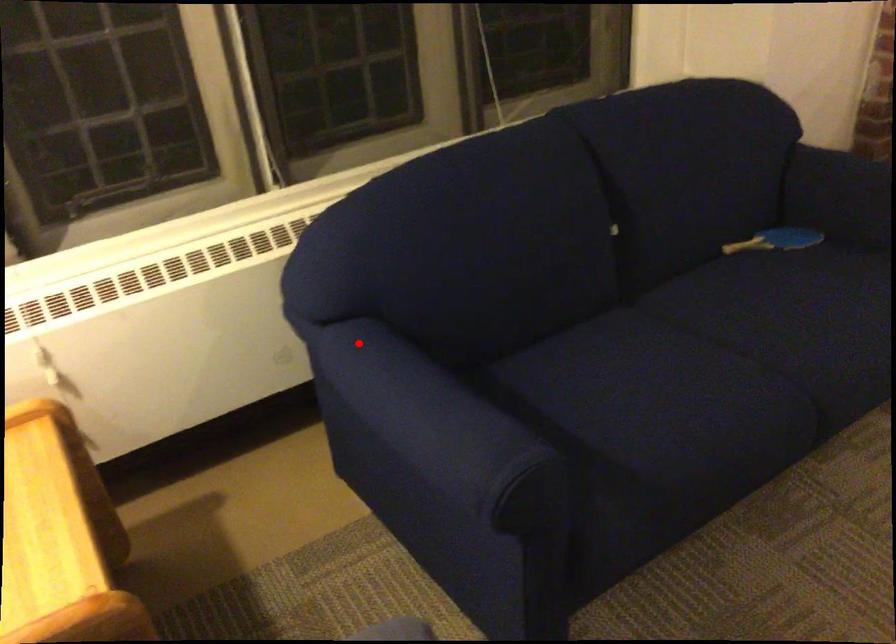
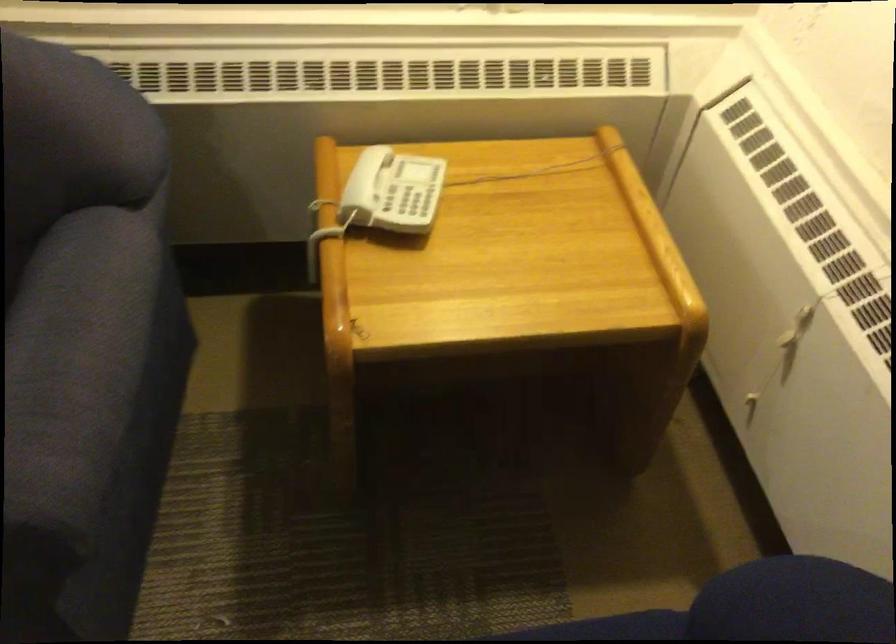
Question: I am providing you with two images of the same scene from different viewpoints. Given a red point in image1, look at the same physical point in image2. Is it:

Choices:
 (A) Closer to the viewpoint
 (B) Farther from the viewpoint

Answer: (A)